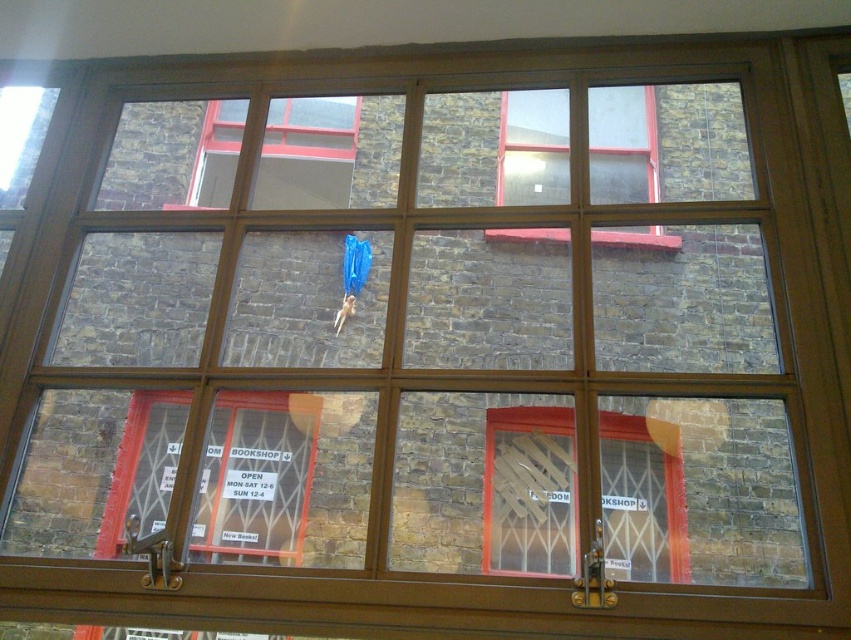
You are an interior designer assessing the reflective properties of the windows in the scene. The clear glass window at center and the matte glass window at upper left are both options for a new project. Which window has less reflective surface?

The clear glass window at center has less reflective surface because it is thinner than the matte glass window at upper left.

You are standing inside the building and looking through the clear glass window at upper center and the matte glass window at upper left. Which window would you see the building across the street through first?

The clear glass window at upper center is in front of matte glass window at upper left, so you would see the building across the street through the clear glass window at upper center first.